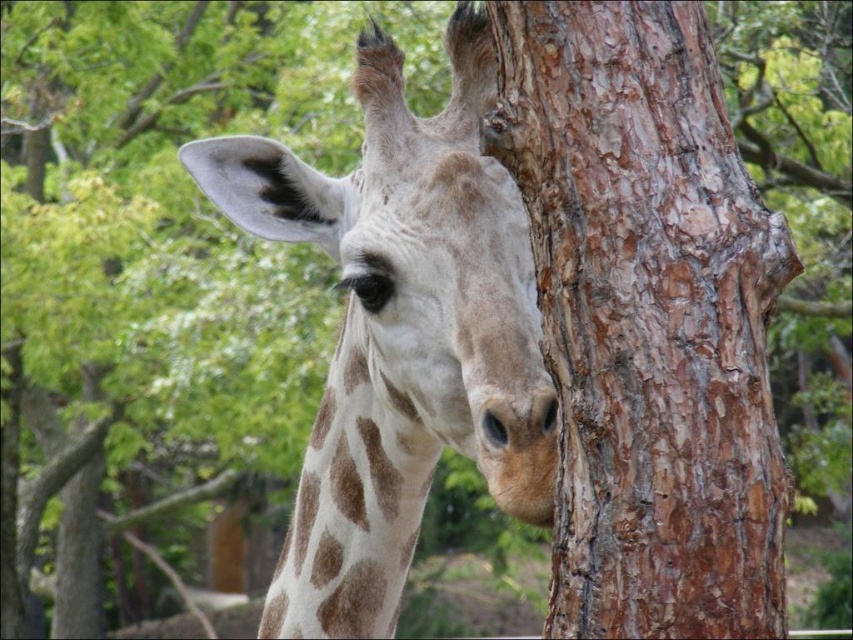
Who is lower down, brown rough bark at center or spotted fur at center?

spotted fur at center is below.

Between brown rough bark at center and spotted fur at center, which one is positioned higher?

brown rough bark at center is higher up.

Between point (741, 195) and point (462, 356), which one is positioned in front?

Positioned in front is point (741, 195).

I want to click on brown rough bark at center, so click(x=647, y=317).